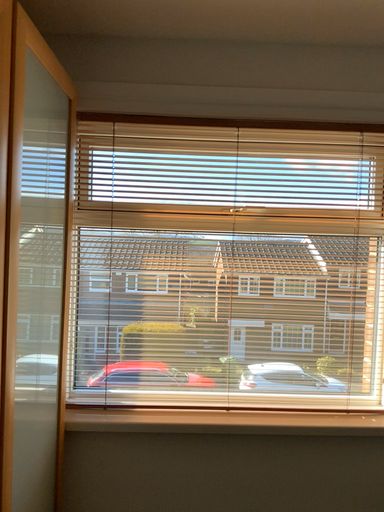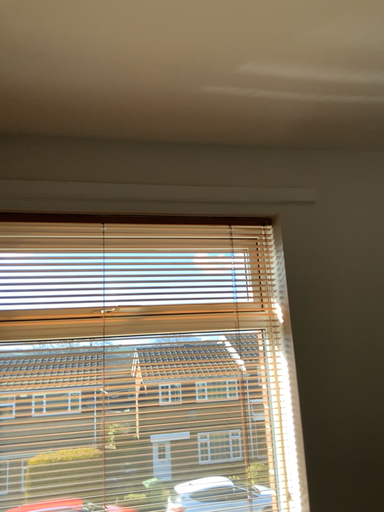
Question: Which way did the camera rotate in the video?

Choices:
 (A) rotated left
 (B) rotated right

Answer: (B)